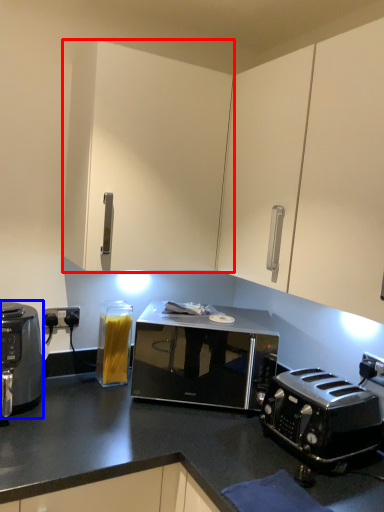
Question: Which object appears farthest to the camera in this image, cabinetry (highlighted by a red box) or home appliance (highlighted by a blue box)?

Choices:
 (A) cabinetry
 (B) home appliance

Answer: (A)